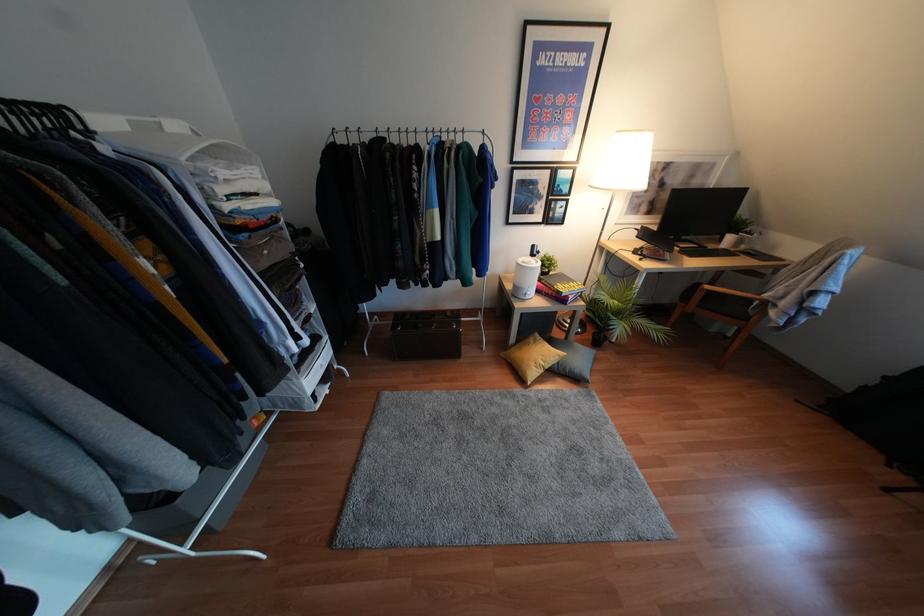
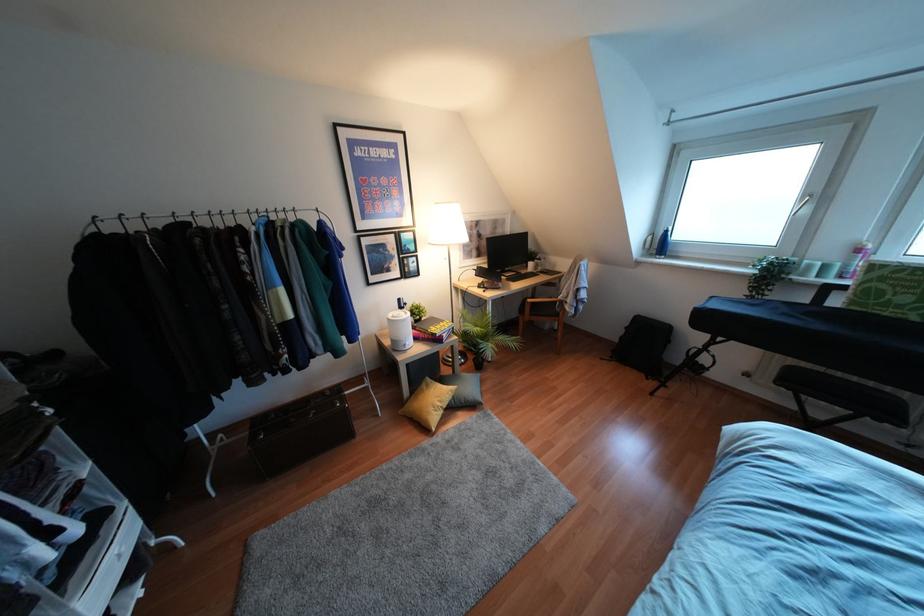
In the second image, find the point that corresponds to the point at 634,252 in the first image.

(478, 286)